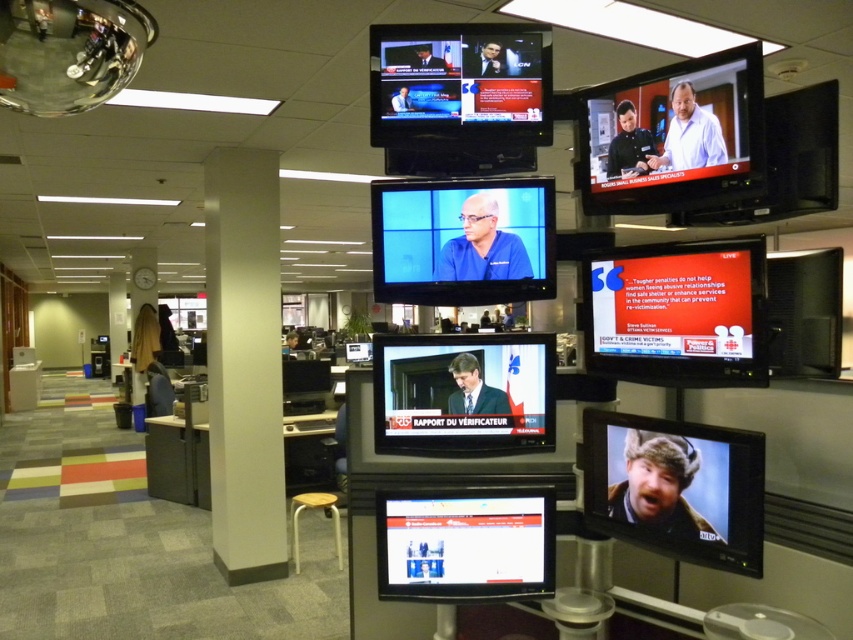
You are a technician in the newsroom. You need to adjust the blue fabric screen at center to ensure it is visible to the audience. Considering the white smooth pillar at center, where should you position it relative to the pillar?

The blue fabric screen at center should be positioned behind the white smooth pillar at center to ensure it is visible to the audience, as it is already placed there according to the description.

You are a technician in the newsroom. You need to adjust the camera to focus on the point at coordinates point (225, 364). The camera has a focal length of 50 mm. What is the minimum distance you need to move the camera to ensure it captures the point within its field of view?

The point at coordinates point (225, 364) is 4.76 meters away from the camera. To ensure the point is within the camera field of view, the technician must position the camera at a distance less than or equal to 4.76 meters from the point.

You are a camera operator standing in the newsroom. Your camera is positioned at the same location as the viewer. You need to film the white smooth pillar at center without any obstructions. Is there enough space between you and the pillar to move the camera freely? Please explain.

The distance between the white smooth pillar at center and the viewer is 4.72 meters. Since there are no obstructions mentioned in the scene description, there should be enough space to move the camera freely while filming the pillar.